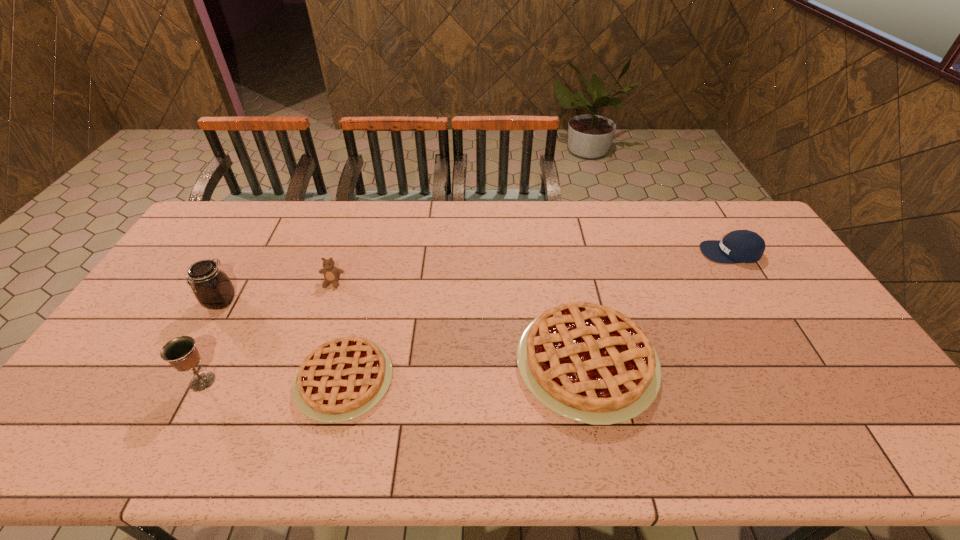
Where is `the shortest object`? This screenshot has height=540, width=960. the shortest object is located at coordinates (342, 379).

What are the coordinates of `the left pie` in the screenshot? It's located at (342, 379).

This screenshot has height=540, width=960. I want to click on the taller pie, so click(589, 363).

Identify the location of the second object from right to left. (x=589, y=363).

The width and height of the screenshot is (960, 540). I want to click on jar, so click(x=213, y=289).

Where is `the fifth nearest object`? This screenshot has height=540, width=960. the fifth nearest object is located at coordinates point(331,273).

Where is `the farthest object`? the farthest object is located at coordinates (740, 246).

Where is `baseball cap`? The width and height of the screenshot is (960, 540). baseball cap is located at coordinates (740, 246).

Locate an element on the screen. The width and height of the screenshot is (960, 540). chalice is located at coordinates (181, 353).

Find the location of `vacant area situated on the back of the shorter pie`. vacant area situated on the back of the shorter pie is located at coordinates (365, 302).